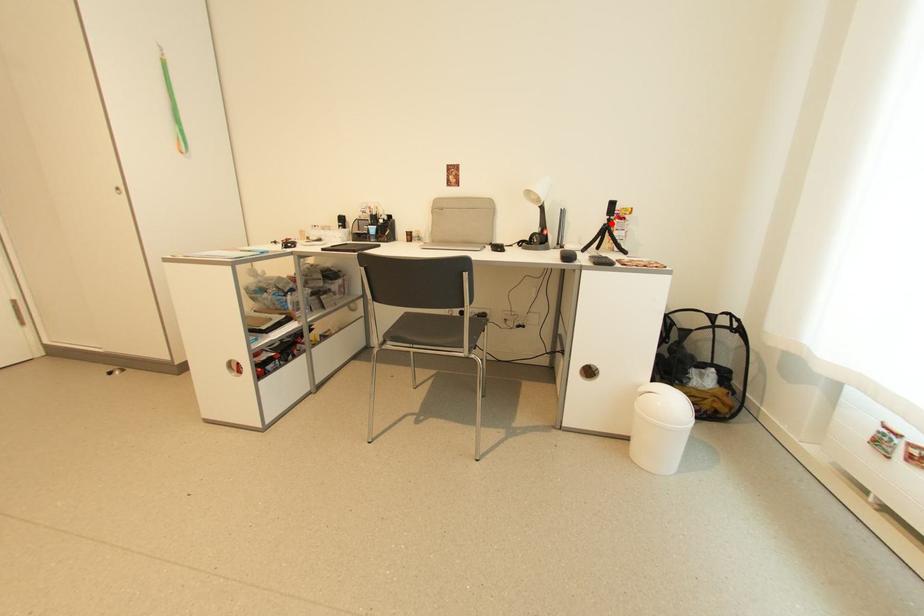
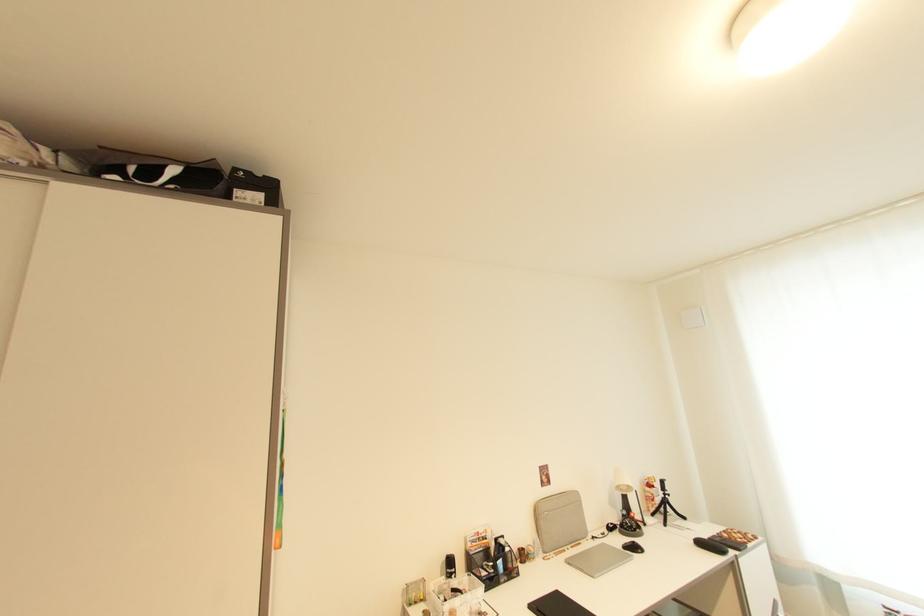
Locate, in the second image, the point that corresponds to the highlighted location in the first image.

(669, 498)